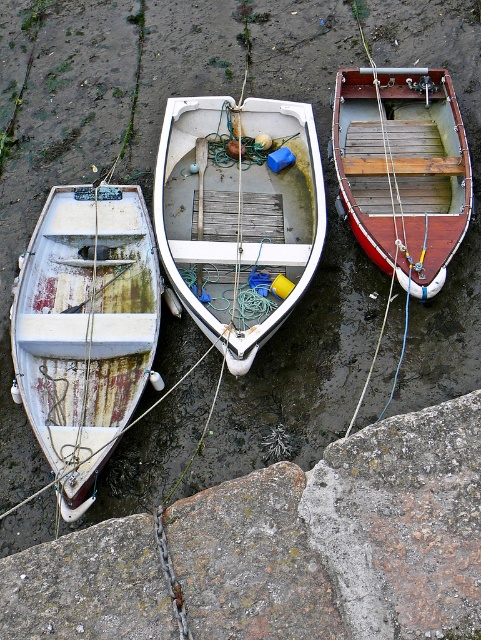
Question: Can you confirm if rusty metal boat at left is thinner than rusty concrete at lower center?

Choices:
 (A) yes
 (B) no

Answer: (B)

Question: Which object is farther from the camera taking this photo?

Choices:
 (A) rusty metal boat at left
 (B) rusty concrete at lower center
 (C) rusty concrete stone at lower left

Answer: (A)

Question: Which object is the closest to the rusty metal boat at left?

Choices:
 (A) wooden boat at center
 (B) rusty concrete stone at lower left

Answer: (A)

Question: Which of the following is the farthest from the observer?

Choices:
 (A) white matte wooden boat at center
 (B) rusty concrete at lower center
 (C) rusty metal boat at left
 (D) wooden boat at center

Answer: (D)

Question: Does rusty concrete stone at lower left have a larger size compared to wooden boat at center?

Choices:
 (A) no
 (B) yes

Answer: (A)

Question: Can you confirm if rusty concrete stone at lower left is wider than rusty concrete at lower center?

Choices:
 (A) yes
 (B) no

Answer: (A)